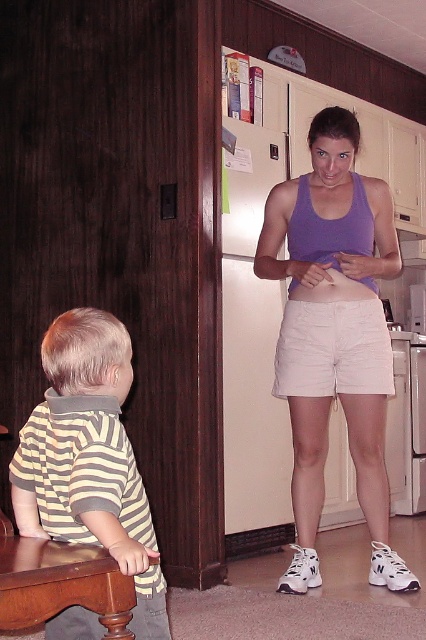
You are standing at the point with coordinates point (x=83, y=483) and want to walk to the point with coordinates point (x=290, y=317). Is there a clear path between these two points without any obstacles?

Point (x=290, y=317) is behind point (x=83, y=483), so there might be an obstacle blocking the path between them. You may need to move around the obstacle to reach the desired point.

You are a delivery person who just arrived at the house. You see the beige cotton shorts at center and the brown wood stool at lower left. Which object is closer to the right side of the room?

The beige cotton shorts at center is closer to the right side of the room because it is positioned to the right of the brown wood stool at lower left.